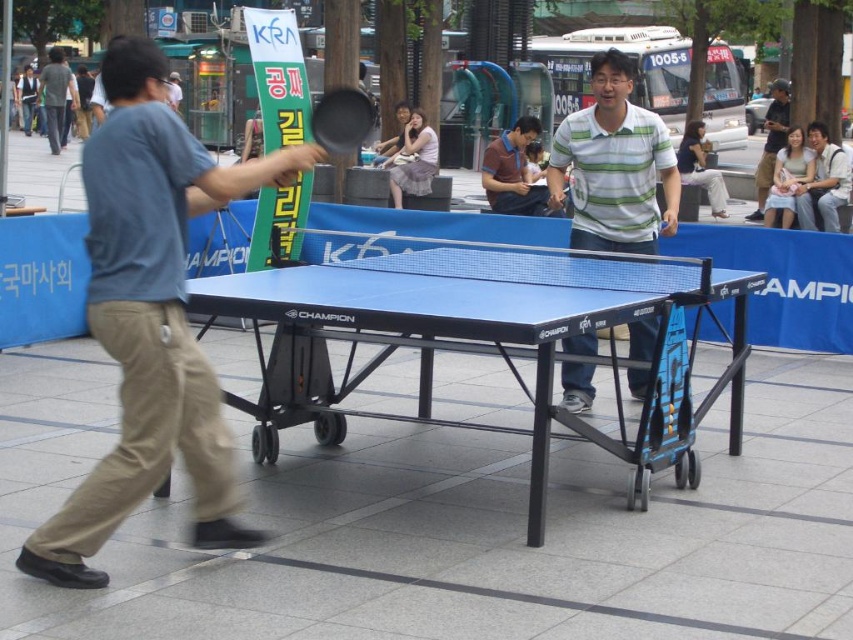
Question: Is blue cotton shirt at left bigger than dark blue jeans at center?

Choices:
 (A) no
 (B) yes

Answer: (A)

Question: Which point is closer to the camera?

Choices:
 (A) (212, 388)
 (B) (815, 148)
 (C) (685, 397)
 (D) (763, 195)

Answer: (A)

Question: Does striped cotton shirt at center have a greater width compared to dark blue shirt at center?

Choices:
 (A) yes
 (B) no

Answer: (B)

Question: Does light brown leather jacket at upper right have a smaller size compared to black rubber paddle at center?

Choices:
 (A) yes
 (B) no

Answer: (B)

Question: Which object is closer to the camera taking this photo?

Choices:
 (A) black rubber paddle at center
 (B) light beige skirt at center
 (C) blue cotton shirt at left

Answer: (C)

Question: Which of the following is the farthest from the observer?

Choices:
 (A) (323, 134)
 (B) (572, 246)
 (C) (252, 438)
 (D) (846, 157)

Answer: (D)